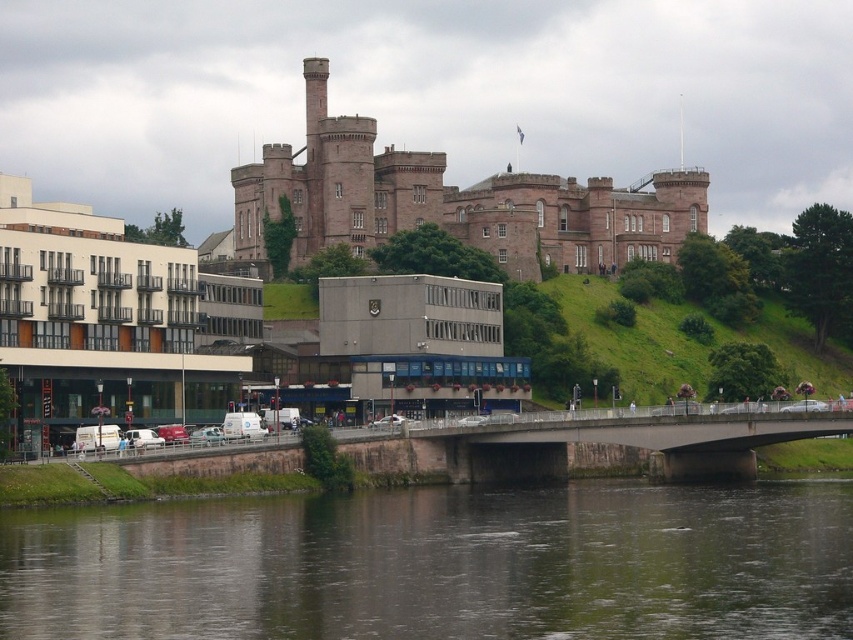
Question: Does dark gray water at lower center have a greater width compared to brown stone castle at upper center?

Choices:
 (A) no
 (B) yes

Answer: (A)

Question: From the image, what is the correct spatial relationship of dark gray water at lower center in relation to brown stone castle at upper center?

Choices:
 (A) right
 (B) left

Answer: (B)

Question: Does dark gray water at lower center lie in front of brown stone castle at upper center?

Choices:
 (A) no
 (B) yes

Answer: (B)

Question: Which of the following is the farthest from the observer?

Choices:
 (A) (16, 538)
 (B) (646, 244)

Answer: (B)